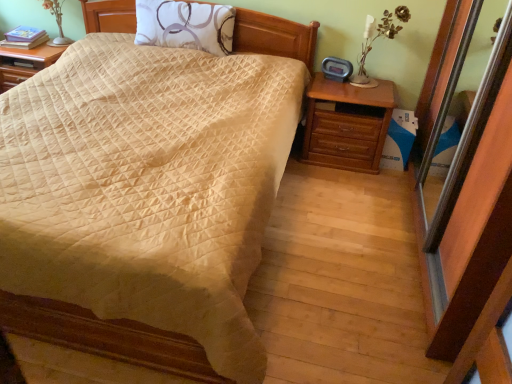
Question: Considering the relative positions of beige quilted bed at center and matte silver table lamp at upper left, which appears as the second table lamp when viewed from the right, in the image provided, is beige quilted bed at center to the left of matte silver table lamp at upper left, which appears as the second table lamp when viewed from the right, from the viewer's perspective?

Choices:
 (A) no
 (B) yes

Answer: (A)

Question: Is beige quilted bed at center with matte silver table lamp at upper left, which appears as the first table lamp when viewed from the left?

Choices:
 (A) no
 (B) yes

Answer: (A)

Question: Considering the relative sizes of beige quilted bed at center and matte silver table lamp at upper left, arranged as the second table lamp when ordered from the bottom, in the image provided, is beige quilted bed at center smaller than matte silver table lamp at upper left, arranged as the second table lamp when ordered from the bottom,?

Choices:
 (A) yes
 (B) no

Answer: (B)

Question: From the image's perspective, is beige quilted bed at center located beneath matte silver table lamp at upper left, which appears as the first table lamp when viewed from the left?

Choices:
 (A) yes
 (B) no

Answer: (A)

Question: Can matte silver table lamp at upper left, which appears as the second table lamp when viewed from the right, be found inside beige quilted bed at center?

Choices:
 (A) yes
 (B) no

Answer: (B)

Question: Is beige quilted bed at center aimed at matte silver table lamp at upper left, which is the 2th table lamp in front-to-back order?

Choices:
 (A) no
 (B) yes

Answer: (A)

Question: Considering the relative positions of white fabric pillow at upper center and beige quilted bed at center in the image provided, is white fabric pillow at upper center to the left of beige quilted bed at center from the viewer's perspective?

Choices:
 (A) yes
 (B) no

Answer: (B)

Question: Is white fabric pillow at upper center positioned with its back to beige quilted bed at center?

Choices:
 (A) yes
 (B) no

Answer: (A)

Question: Considering the relative sizes of white fabric pillow at upper center and beige quilted bed at center in the image provided, is white fabric pillow at upper center wider than beige quilted bed at center?

Choices:
 (A) no
 (B) yes

Answer: (A)

Question: From a real-world perspective, is white fabric pillow at upper center on beige quilted bed at center?

Choices:
 (A) yes
 (B) no

Answer: (A)

Question: From the image's perspective, would you say white fabric pillow at upper center is positioned over beige quilted bed at center?

Choices:
 (A) yes
 (B) no

Answer: (A)

Question: Is white fabric pillow at upper center bigger than beige quilted bed at center?

Choices:
 (A) yes
 (B) no

Answer: (B)

Question: From the image's perspective, is white fabric pillow at upper center above matte silver table lamp at upper left, the first table lamp positioned from the top?

Choices:
 (A) no
 (B) yes

Answer: (A)